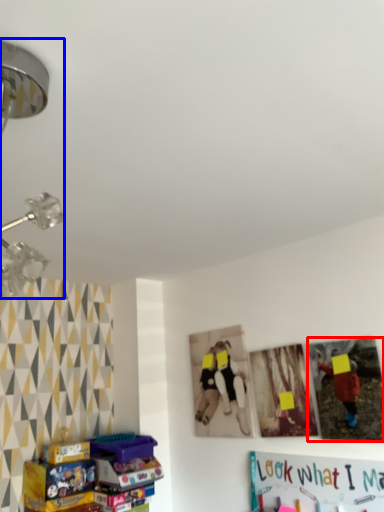
Question: Which of the following is the closest to the observer, picture frame (highlighted by a red box) or lamp (highlighted by a blue box)?

Choices:
 (A) picture frame
 (B) lamp

Answer: (B)